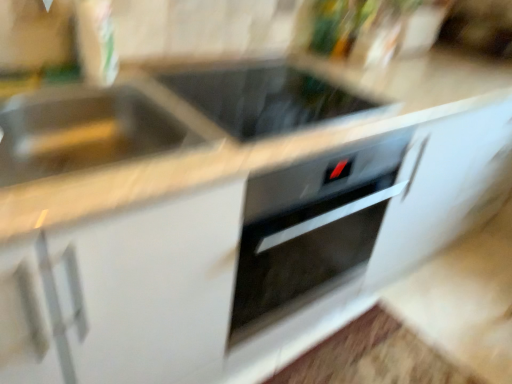
Question: Considering the relative positions of metallic silver sink at left and black glass cooktop at center in the image provided, is metallic silver sink at left behind black glass cooktop at center?

Choices:
 (A) yes
 (B) no

Answer: (B)

Question: Is metallic silver sink at left outside of black glass cooktop at center?

Choices:
 (A) yes
 (B) no

Answer: (A)

Question: Is metallic silver sink at left to the left of black glass cooktop at center from the viewer's perspective?

Choices:
 (A) no
 (B) yes

Answer: (B)

Question: Does metallic silver sink at left turn towards black glass cooktop at center?

Choices:
 (A) no
 (B) yes

Answer: (A)

Question: Is metallic silver sink at left looking in the opposite direction of black glass cooktop at center?

Choices:
 (A) no
 (B) yes

Answer: (A)

Question: From the image's perspective, is metallic silver sink at left located beneath black glass cooktop at center?

Choices:
 (A) yes
 (B) no

Answer: (A)

Question: Is metallic silver sink at left located within black glass cooktop at center?

Choices:
 (A) yes
 (B) no

Answer: (B)

Question: From the image's perspective, would you say black glass cooktop at center is shown under metallic silver sink at left?

Choices:
 (A) yes
 (B) no

Answer: (B)

Question: Can you confirm if black glass cooktop at center is wider than metallic silver sink at left?

Choices:
 (A) no
 (B) yes

Answer: (B)

Question: Does black glass cooktop at center have a lesser height compared to metallic silver sink at left?

Choices:
 (A) yes
 (B) no

Answer: (A)

Question: Is metallic silver sink at left at the back of black glass cooktop at center?

Choices:
 (A) yes
 (B) no

Answer: (B)

Question: From a real-world perspective, is black glass cooktop at center under metallic silver sink at left?

Choices:
 (A) no
 (B) yes

Answer: (A)

Question: Is point (45, 152) closer or farther from the camera than point (223, 112)?

Choices:
 (A) farther
 (B) closer

Answer: (B)